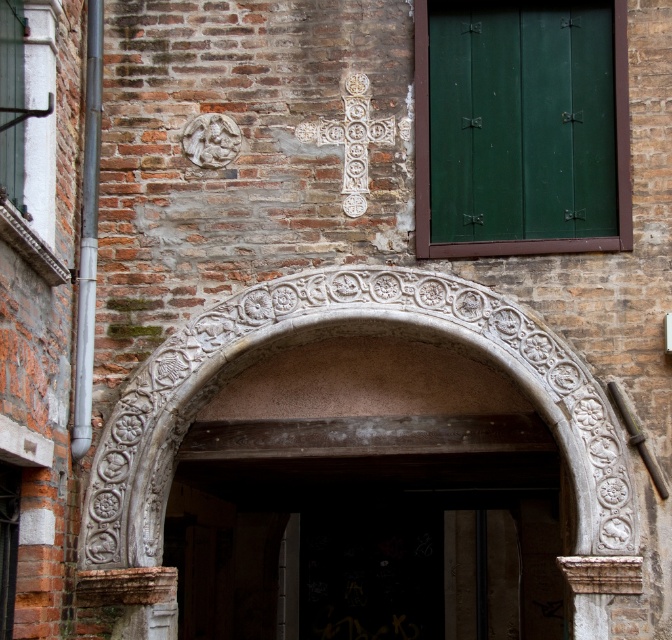
Question: Can you confirm if carved stone archway at center is positioned to the left of green matte door at upper right?

Choices:
 (A) yes
 (B) no

Answer: (A)

Question: Is carved stone archway at center behind white stone archway at center?

Choices:
 (A) yes
 (B) no

Answer: (A)

Question: Can you confirm if carved stone archway at center is positioned to the right of white stone archway at center?

Choices:
 (A) no
 (B) yes

Answer: (A)

Question: Which point is farther to the camera?

Choices:
 (A) (263, 632)
 (B) (532, 218)
 (C) (282, 289)

Answer: (A)

Question: Which point is farther from the camera taking this photo?

Choices:
 (A) click(437, 172)
 (B) click(208, 484)

Answer: (B)

Question: Estimate the real-world distances between objects in this image. Which object is closer to the white stone archway at center?

Choices:
 (A) green matte door at upper right
 (B) carved stone archway at center

Answer: (A)